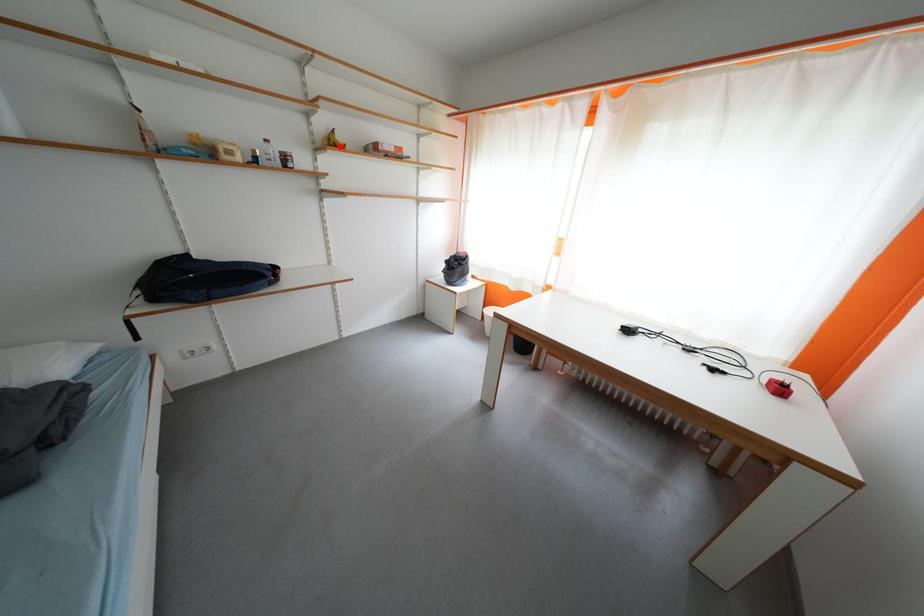
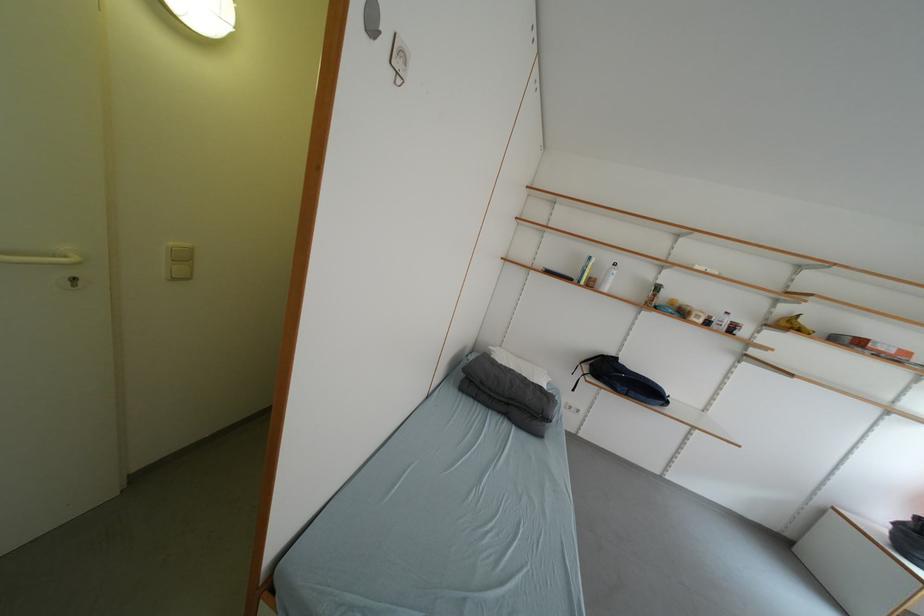
Question: I am providing you with two images of the same scene from different viewpoints. A red point is marked on the first image. Can you still see the location of the red point in image 2?

Choices:
 (A) Yes
 (B) No

Answer: (A)